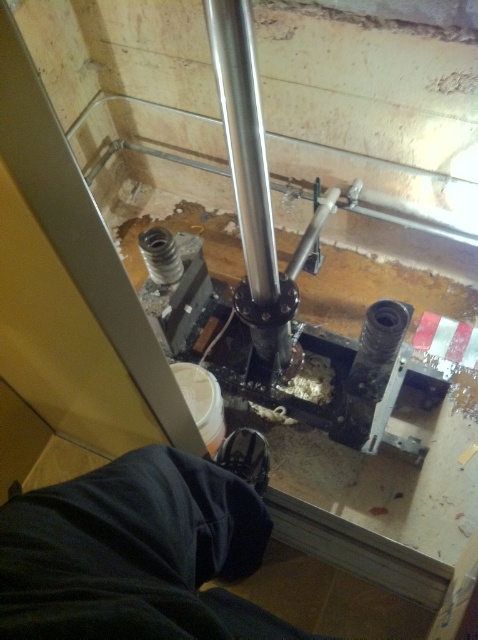
You are a construction worker in the room. You need to move the dark blue fabric at lower left to a safer location. Based on the coordinates provided, where exactly is the dark blue fabric located in the scene?

The dark blue fabric at lower left is located at coordinates point (136,554), so you should move it from that specific location to a safer area.

You are a construction worker in the room. You need to move the polished metal pipe at center to the dark blue fabric at lower left. Can you move it directly without moving any other objects?

The dark blue fabric at lower left is to the left of the polished metal pipe at center, so you can move the polished metal pipe at center directly to the dark blue fabric at lower left without moving other objects.

You are a construction worker needing to place a 1.2 meter long tool between the dark blue fabric at lower left and the polished metal pipe at center. Can you fit it horizontally without bending the tool?

The dark blue fabric at lower left might be wider than the polished metal pipe at center, but the exact width isn t specified. Without knowing the exact dimensions, it s uncertain if the 1.2 meter tool will fit horizontally between them.